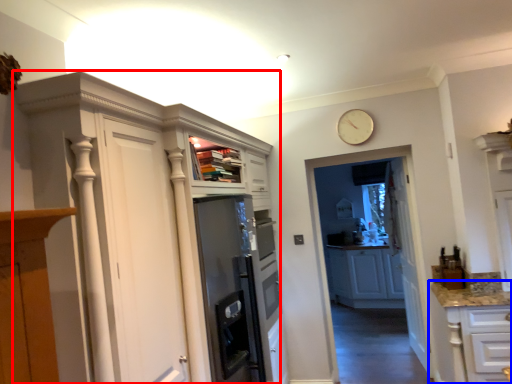
Question: Among these objects, which one is farthest to the camera, cupboard (highlighted by a red box) or cabinetry (highlighted by a blue box)?

Choices:
 (A) cupboard
 (B) cabinetry

Answer: (B)